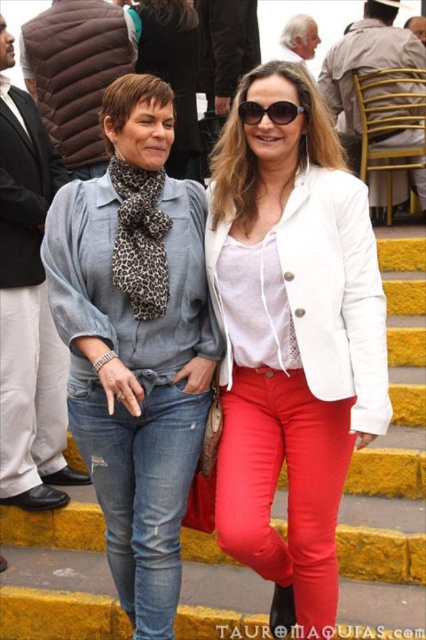
Question: Can you confirm if white leather jacket at center is smaller than denim jeans at left?

Choices:
 (A) yes
 (B) no

Answer: (B)

Question: Is the position of white leather jacket at center less distant than that of ripped denim jeans at center?

Choices:
 (A) yes
 (B) no

Answer: (A)

Question: Among these objects, which one is nearest to the camera?

Choices:
 (A) yellow painted stairs at center
 (B) sunglasses at center

Answer: (A)

Question: Which point is farther from the camera taking this photo?

Choices:
 (A) [x=267, y=321]
 (B) [x=126, y=163]
 (C) [x=138, y=456]

Answer: (B)

Question: Does yellow painted stairs at center come behind ripped denim jeans at center?

Choices:
 (A) no
 (B) yes

Answer: (A)

Question: Which object appears farthest from the camera in this image?

Choices:
 (A) white leather jacket at center
 (B) sunglasses at center
 (C) ripped denim jeans at center
 (D) denim jeans at left

Answer: (C)